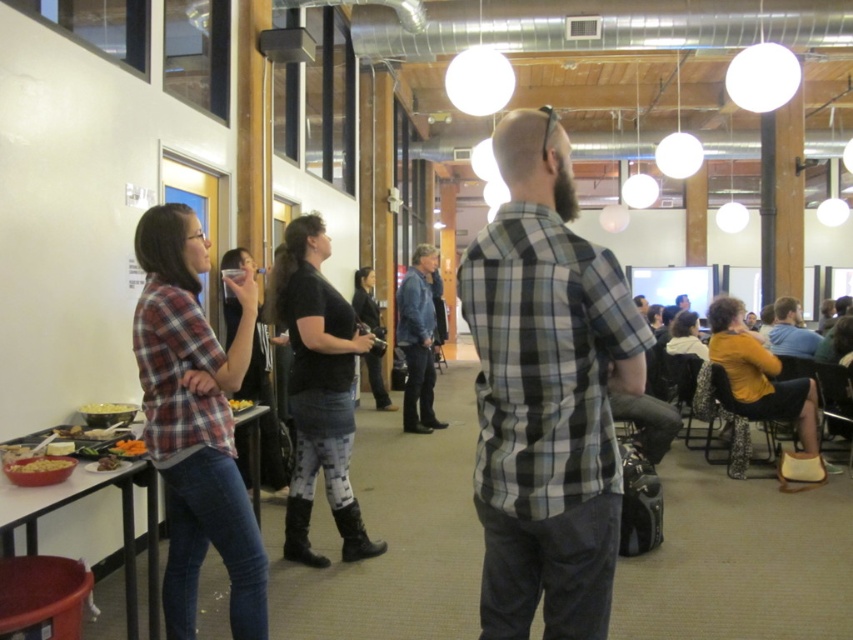
You are at a party and want to choose a bowl to serve snacks. The matte plastic bowl at lower left and the smooth brown bowl at lower left are available. Which bowl is taller?

The smooth brown bowl at lower left is taller than the matte plastic bowl at lower left.

You are at the event and want to place a small gift on the floor near the matte orange snack at lower left without blocking the black matte boots at center. Where should you place it?

Place the gift to the left of the matte orange snack at lower left since the black matte boots at center are to the right of the snack, so placing it left keeps it unobstructed.